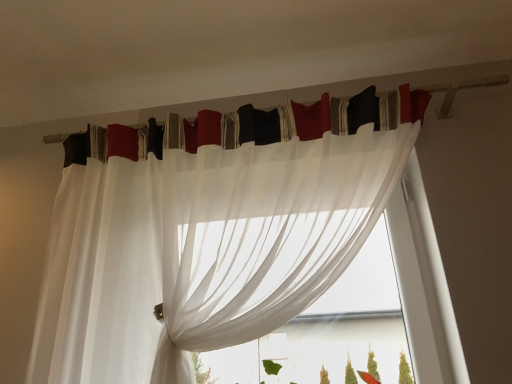
Question: From the image's perspective, is white sheer curtain at upper center, which is the first curtain in top-to-bottom order, over sheer white curtain at center?

Choices:
 (A) no
 (B) yes

Answer: (B)

Question: Are white sheer curtain at upper center, which is the first curtain in top-to-bottom order, and sheer white curtain at center located far from each other?

Choices:
 (A) yes
 (B) no

Answer: (B)

Question: From a real-world perspective, does white sheer curtain at upper center, the second curtain positioned from the bottom, stand above sheer white curtain at center?

Choices:
 (A) yes
 (B) no

Answer: (A)

Question: Are white sheer curtain at upper center, the second curtain positioned from the bottom, and sheer white curtain at center beside each other?

Choices:
 (A) no
 (B) yes

Answer: (A)

Question: Considering the relative sizes of white sheer curtain at upper center, which is the first curtain in top-to-bottom order, and sheer white curtain at center in the image provided, is white sheer curtain at upper center, which is the first curtain in top-to-bottom order, shorter than sheer white curtain at center?

Choices:
 (A) yes
 (B) no

Answer: (A)

Question: Is white sheer curtain at upper center, which is the first curtain in top-to-bottom order, positioned behind sheer white curtain at center?

Choices:
 (A) no
 (B) yes

Answer: (B)

Question: Is sheer white curtain at upper center, which appears as the first curtain when ordered from the bottom, completely or partially outside of sheer white curtain at center?

Choices:
 (A) no
 (B) yes

Answer: (B)

Question: Does sheer white curtain at upper center, arranged as the 2th curtain when viewed from the top, appear on the left side of sheer white curtain at center?

Choices:
 (A) yes
 (B) no

Answer: (A)

Question: From the image's perspective, is sheer white curtain at upper center, which appears as the first curtain when ordered from the bottom, under sheer white curtain at center?

Choices:
 (A) yes
 (B) no

Answer: (B)

Question: Considering the relative sizes of sheer white curtain at upper center, which appears as the first curtain when ordered from the bottom, and sheer white curtain at center in the image provided, is sheer white curtain at upper center, which appears as the first curtain when ordered from the bottom, taller than sheer white curtain at center?

Choices:
 (A) no
 (B) yes

Answer: (B)

Question: Is sheer white curtain at upper center, which appears as the first curtain when ordered from the bottom, not near sheer white curtain at center?

Choices:
 (A) yes
 (B) no

Answer: (B)

Question: From a real-world perspective, is sheer white curtain at upper center, which appears as the first curtain when ordered from the bottom, physically below sheer white curtain at center?

Choices:
 (A) yes
 (B) no

Answer: (B)

Question: Is sheer white curtain at center to the right of white sheer curtain at upper center, the second curtain positioned from the bottom, from the viewer's perspective?

Choices:
 (A) yes
 (B) no

Answer: (A)